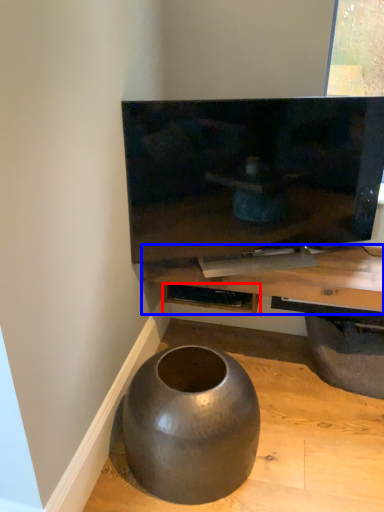
Question: Among these objects, which one is farthest to the camera, shelf (highlighted by a red box) or table (highlighted by a blue box)?

Choices:
 (A) shelf
 (B) table

Answer: (A)